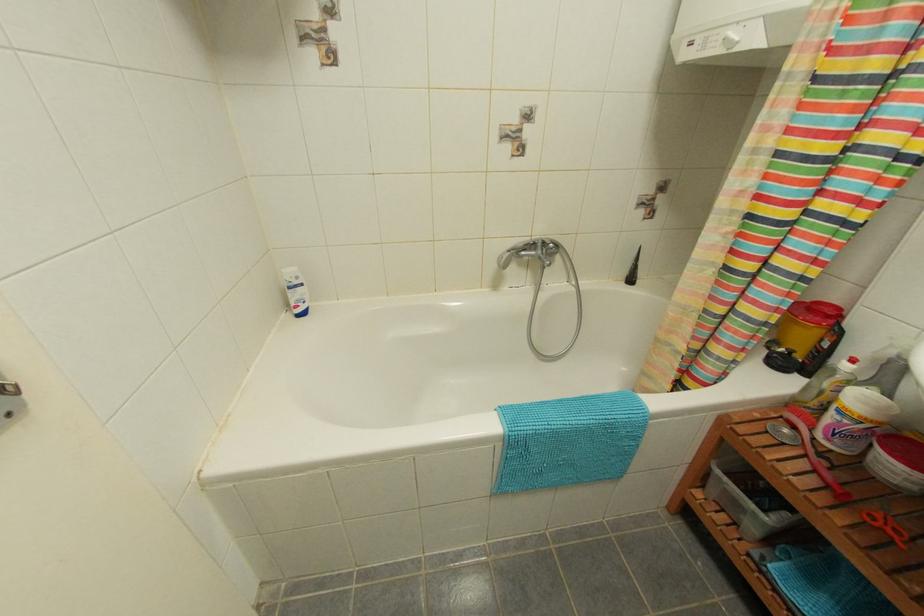
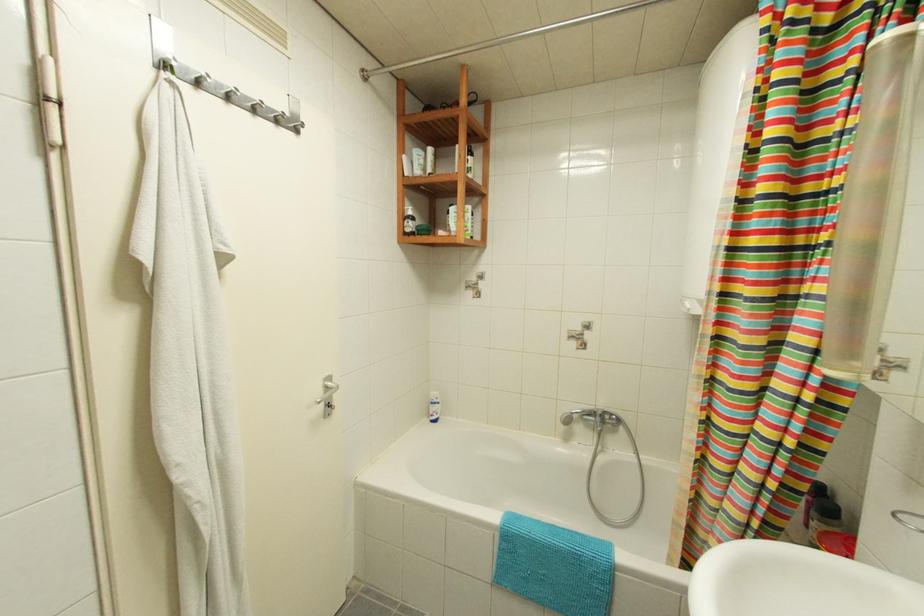
First-person continuous shooting, in which direction is the camera rotating?

The camera's rotation is toward left-up.